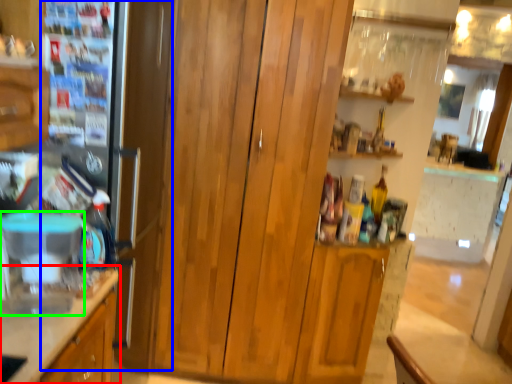
Question: Which object is the farthest from cabinetry (highlighted by a red box)? Choose among these: fridge (highlighted by a blue box) or appliance (highlighted by a green box).

Choices:
 (A) fridge
 (B) appliance

Answer: (A)